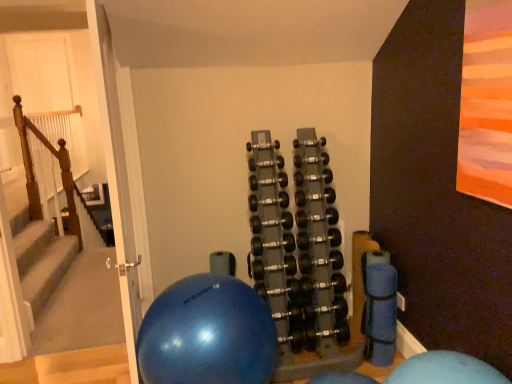
Question: Is black rubber dumbbells at center taller or shorter than wooden at left?

Choices:
 (A) short
 (B) tall

Answer: (A)

Question: Looking at their shapes, would you say black rubber dumbbells at center is wider or thinner than wooden at left?

Choices:
 (A) wide
 (B) thin

Answer: (A)

Question: Which object is positioned closest to the wooden at left?

Choices:
 (A) black rubber dumbbells at center
 (B) blue rubber ball at center

Answer: (A)

Question: Estimate the real-world distances between objects in this image. Which object is farther from the blue rubber ball at center?

Choices:
 (A) wooden at left
 (B) black rubber dumbbells at center

Answer: (A)